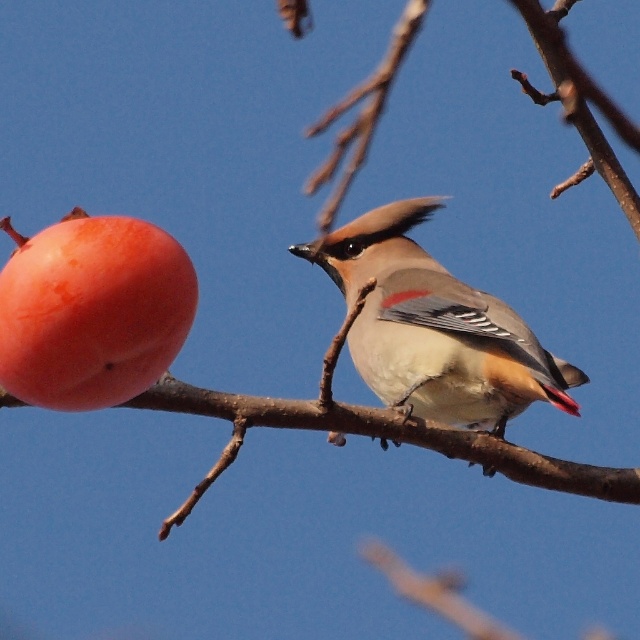
You are a birdwatcher observing the scene. You notice the matte gray bird at center and the smooth orange persimmon at left. Which object is positioned to the right of the other?

The matte gray bird at center is positioned to the right of the smooth orange persimmon at left.

You are an ornithologist observing a bird in a clear blue sky. You notice a point at coordinates (x=435, y=328). Which object does this point correspond to?

The point at coordinates (x=435, y=328) corresponds to the matte gray bird at center.

You are a photographer aiming to capture the matte gray bird at center and the smooth orange persimmon at left in your shot. Which object is closer to your camera lens?

The matte gray bird at center is closer to the camera lens because it is positioned further to the viewer than the smooth orange persimmon at left.